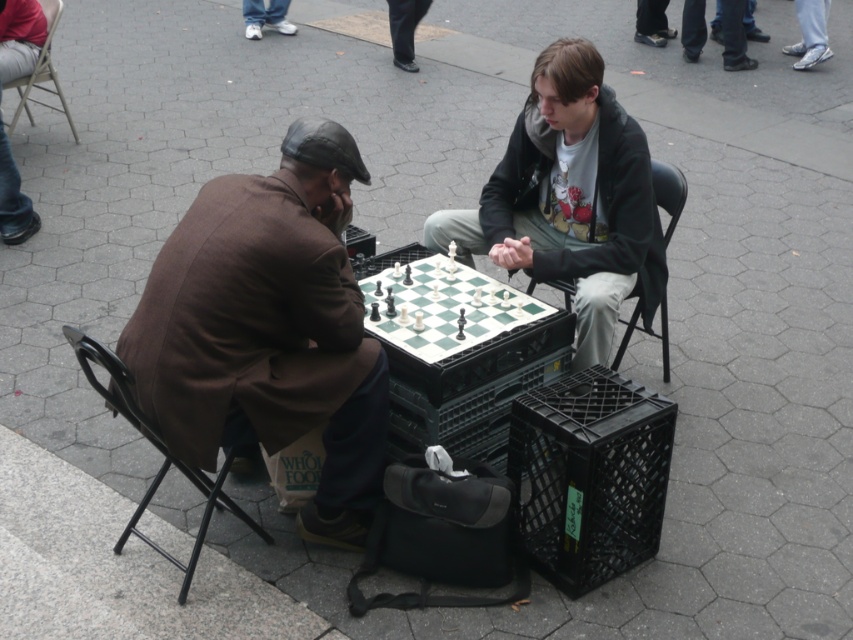
Question: Which object appears closest to the camera in this image?

Choices:
 (A) black leather shoes at lower right
 (B) white plastic chessboard at center
 (C) black metal chair at left
 (D) brown wool coat at left

Answer: (C)

Question: Can you confirm if white plastic chessboard at center is smaller than black metal chair at left?

Choices:
 (A) no
 (B) yes

Answer: (B)

Question: Does white plastic chessboard at center appear under jeans at left?

Choices:
 (A) yes
 (B) no

Answer: (A)

Question: Observing the image, what is the correct spatial positioning of black metal chair at left in reference to black leather shoes at lower right?

Choices:
 (A) right
 (B) left

Answer: (B)

Question: Which object is positioned farthest from the white plastic chessboard at center?

Choices:
 (A) brown wool coat at left
 (B) black metal chair at left

Answer: (B)

Question: Which of the following is the closest to the observer?

Choices:
 (A) (659, 161)
 (B) (589, 44)
 (C) (20, 4)

Answer: (B)